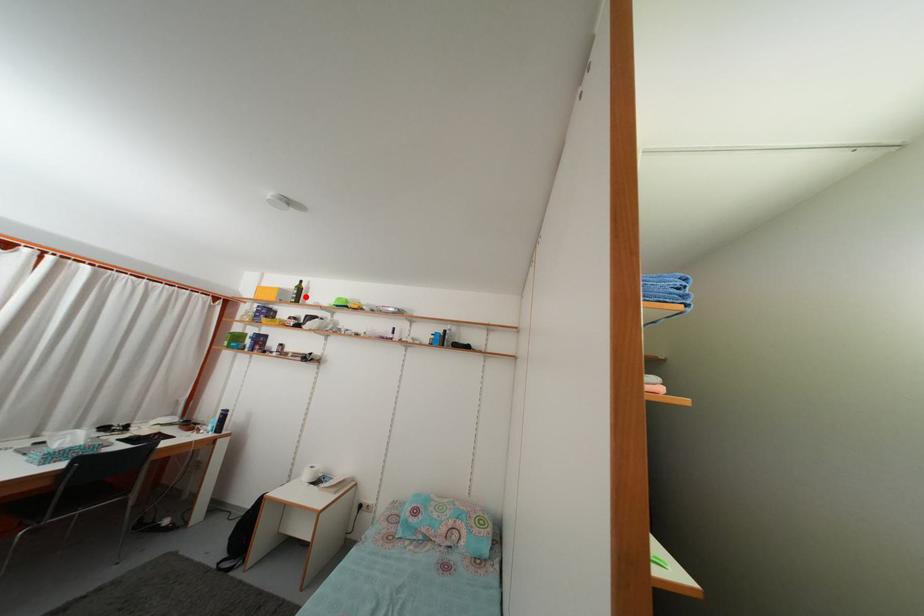
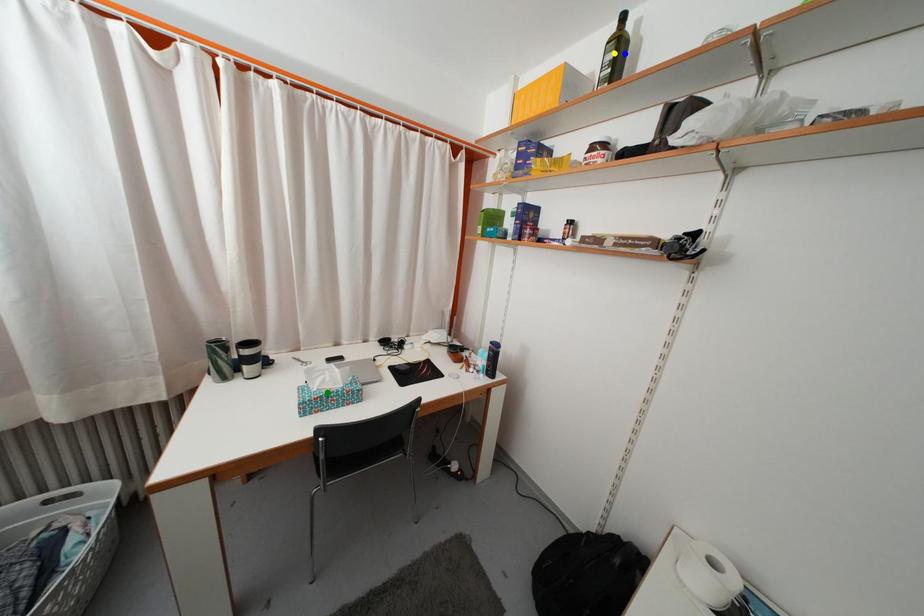
Question: I am providing you with two images of the same scene from different viewpoints. A red point is marked on the first image. You are given multiple points on the second image. Which point in image 2 represents the same 3d spot as the red point in image 1?

Choices:
 (A) green point
 (B) blue point
 (C) yellow point

Answer: (B)